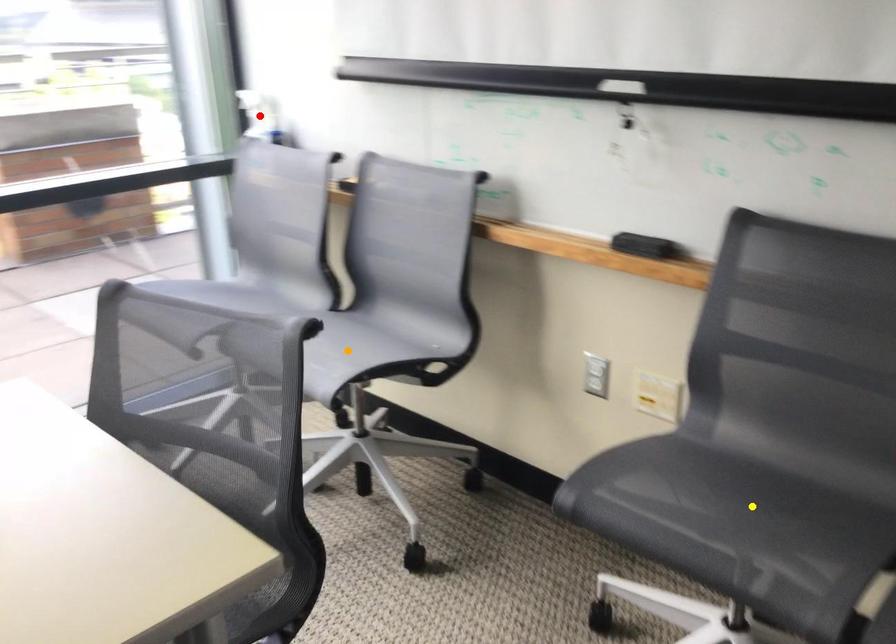
Order these from nearest to farthest:
orange point, yellow point, red point

yellow point < orange point < red point